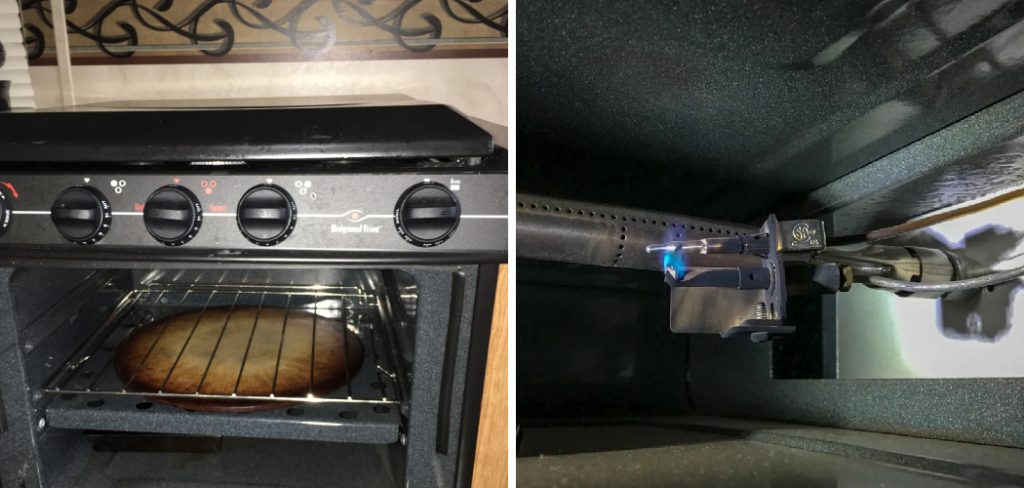
You are a GUI agent. You are given a task and a screenshot of the screen. Output one action in this format:
    pyautogui.click(x=<x>, y=<y>)
    Task: Click on the white wall
    
    Given the screenshot: What is the action you would take?
    pyautogui.click(x=890, y=336)